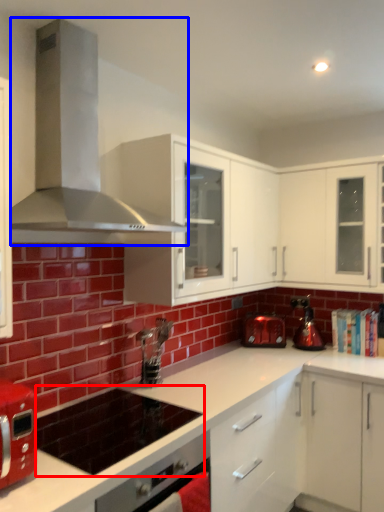
Question: Which of the following is the closest to the observer, appliance (highlighted by a red box) or home appliance (highlighted by a blue box)?

Choices:
 (A) appliance
 (B) home appliance

Answer: (B)